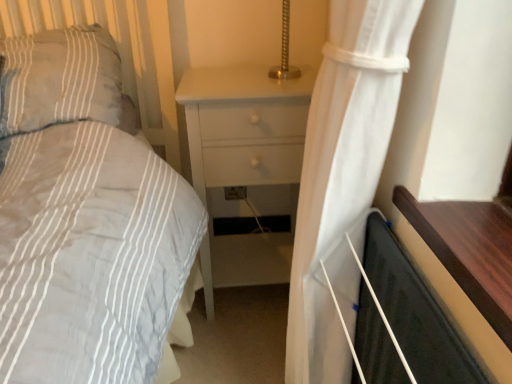
Question: Is white sheer curtain at right bigger or smaller than black matte screen door at lower right?

Choices:
 (A) big
 (B) small

Answer: (A)

Question: Is white sheer curtain at right to the left or to the right of black matte screen door at lower right in the image?

Choices:
 (A) right
 (B) left

Answer: (B)

Question: Which object is positioned closest to the black matte screen door at lower right?

Choices:
 (A) gray striped pillow at upper left
 (B) white sheer curtain at right
 (C) white matte nightstand at center

Answer: (B)

Question: Which object is positioned farthest from the black matte screen door at lower right?

Choices:
 (A) white matte nightstand at center
 (B) gray striped pillow at upper left
 (C) white sheer curtain at right

Answer: (B)